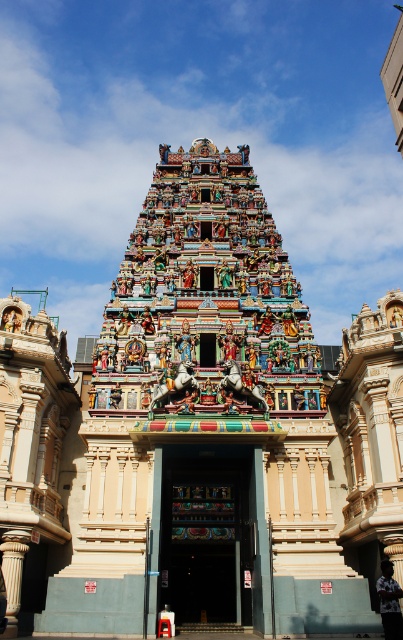
Question: Is multicolored carved temple at center to the left of white printed shirt at center from the viewer's perspective?

Choices:
 (A) no
 (B) yes

Answer: (B)

Question: Can you confirm if wooden carved door at center is positioned to the left of white printed shirt at center?

Choices:
 (A) no
 (B) yes

Answer: (B)

Question: Among these objects, which one is nearest to the camera?

Choices:
 (A) multicolored carved temple at center
 (B) white printed shirt at center
 (C) wooden carved door at center

Answer: (B)

Question: From the image, what is the correct spatial relationship of multicolored carved temple at center in relation to wooden carved door at center?

Choices:
 (A) right
 (B) left

Answer: (A)

Question: Which point is closer to the camera?

Choices:
 (A) multicolored carved temple at center
 (B) wooden carved door at center
 (C) white printed shirt at center

Answer: (C)

Question: Which object appears farthest from the camera in this image?

Choices:
 (A) wooden carved door at center
 (B) white printed shirt at center
 (C) multicolored carved temple at center

Answer: (C)